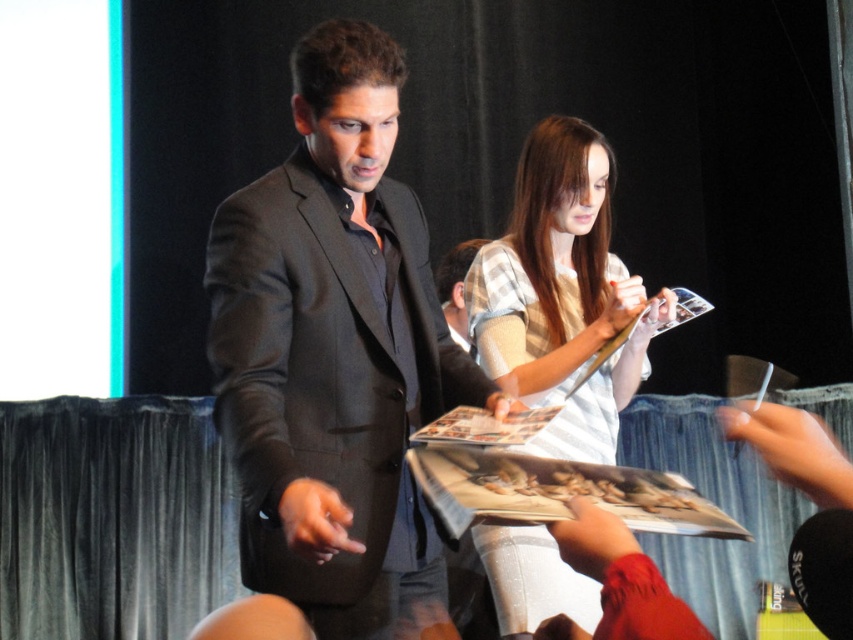
Question: Can you confirm if matte black suit at center is thinner than light beige plaid shirt at center?

Choices:
 (A) no
 (B) yes

Answer: (A)

Question: Does matte black suit at center appear over light beige plaid shirt at center?

Choices:
 (A) no
 (B) yes

Answer: (B)

Question: Does matte black suit at center appear over light beige plaid shirt at center?

Choices:
 (A) yes
 (B) no

Answer: (A)

Question: Which of the following is the closest to the observer?

Choices:
 (A) matte black suit at center
 (B) light beige plaid shirt at center

Answer: (A)

Question: Which point is closer to the camera taking this photo?

Choices:
 (A) (534, 404)
 (B) (392, 483)

Answer: (B)